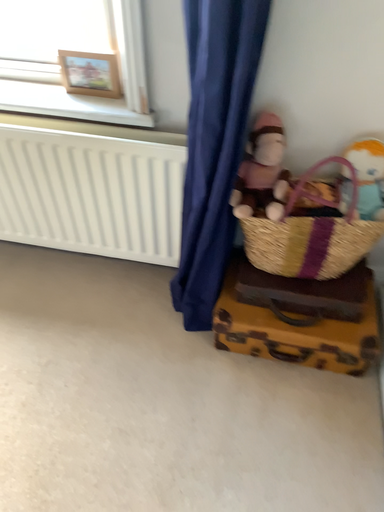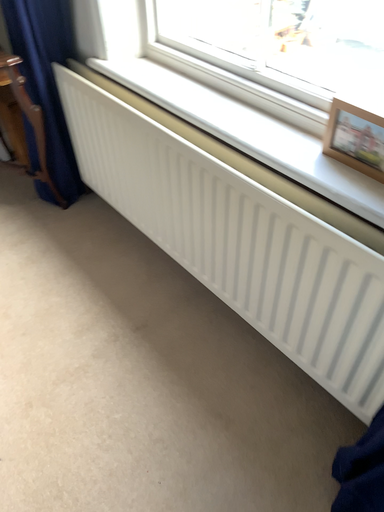
Question: Which way did the camera rotate in the video?

Choices:
 (A) rotated upward
 (B) rotated downward

Answer: (A)